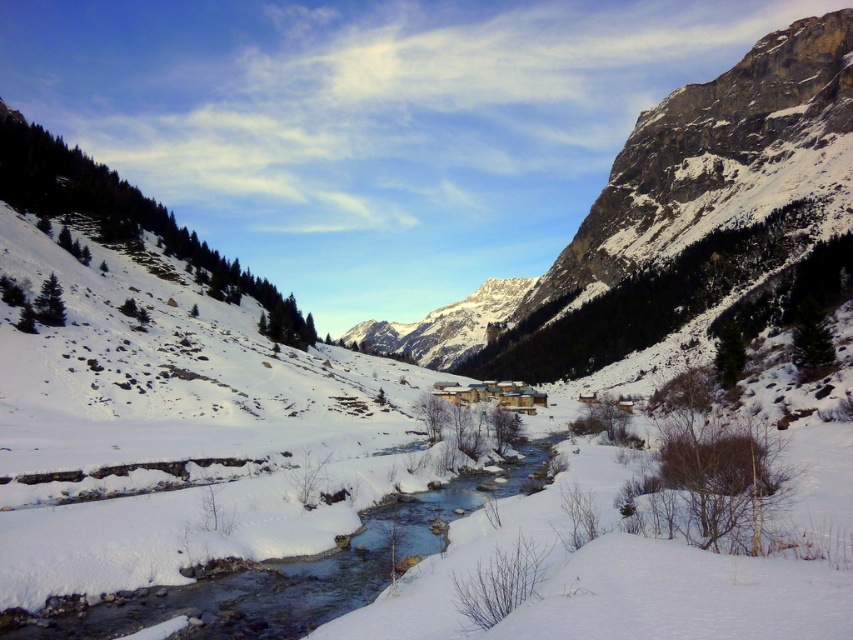
Does clear ice water at center have a greater width compared to snowy granite mountain at center?

In fact, clear ice water at center might be narrower than snowy granite mountain at center.

Measure the distance between clear ice water at center and camera.

They are 130.01 feet apart.

Find the location of `clear ice water at center`. clear ice water at center is located at coordinates (283, 573).